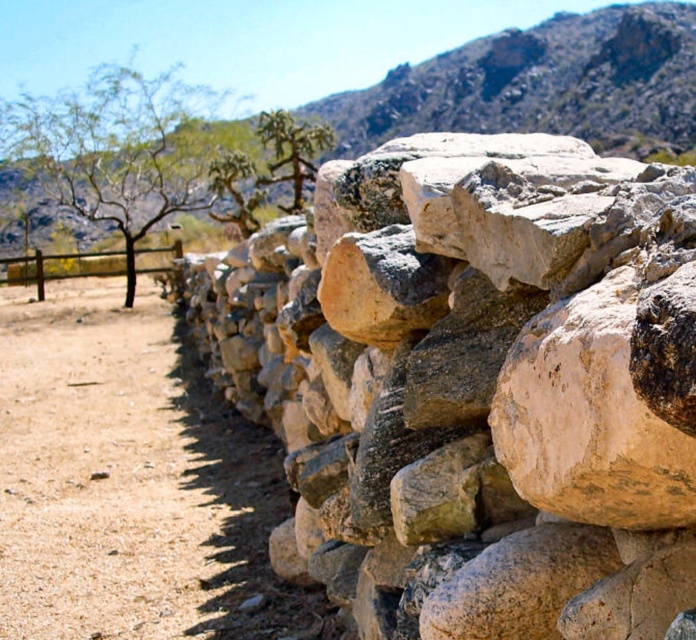
Question: Does natural stone wall at center lie behind brown wooden fence at left?

Choices:
 (A) no
 (B) yes

Answer: (A)

Question: Is natural stone wall at center to the right of brown wooden fence at left from the viewer's perspective?

Choices:
 (A) yes
 (B) no

Answer: (A)

Question: Estimate the real-world distances between objects in this image. Which object is farther from the brown wooden fence at left?

Choices:
 (A) green leafy tree at upper left
 (B) green spiny at upper center

Answer: (B)

Question: Which object is positioned farthest from the green spiny at upper center?

Choices:
 (A) natural stone wall at center
 (B) green leafy tree at upper left

Answer: (A)

Question: Among these points, which one is nearest to the camera?

Choices:
 (A) (299, 177)
 (B) (63, 93)

Answer: (A)

Question: Observing the image, what is the correct spatial positioning of natural stone wall at center in reference to green spiny at upper center?

Choices:
 (A) below
 (B) above

Answer: (A)